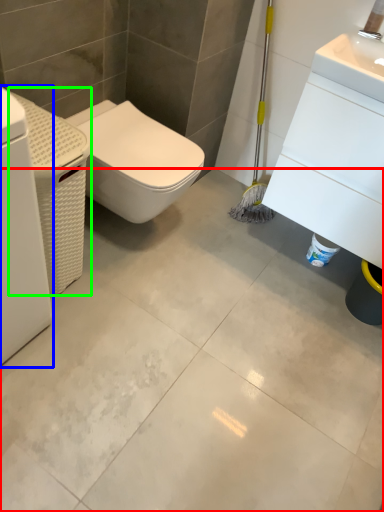
Question: Estimate the real-world distances between objects in this image. Which object is farther from concrete (highlighted by a red box), washing machine (highlighted by a blue box) or porcelain (highlighted by a green box)?

Choices:
 (A) washing machine
 (B) porcelain

Answer: (A)